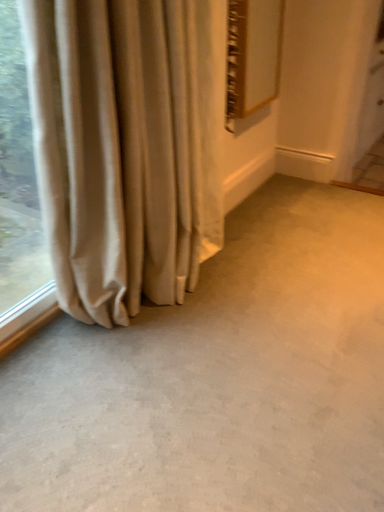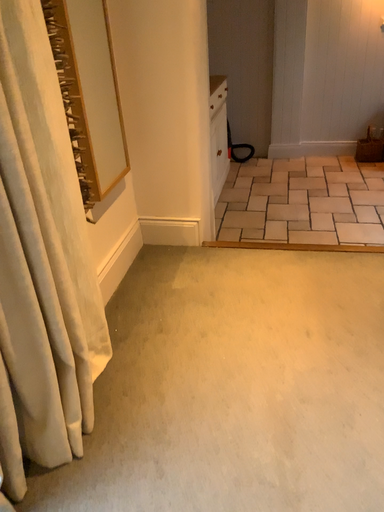
Question: How did the camera likely rotate when shooting the video?

Choices:
 (A) rotated downward
 (B) rotated upward

Answer: (B)